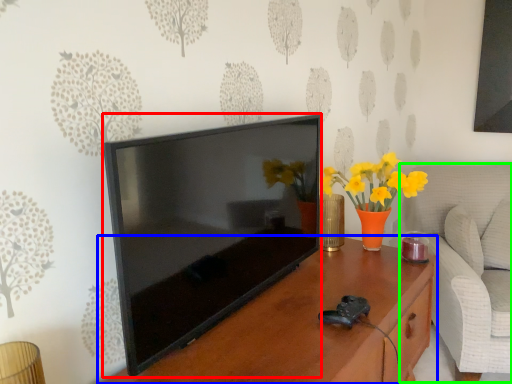
Question: Estimate the real-world distances between objects in this image. Which object is farther from television (highlighted by a red box), table (highlighted by a blue box) or swivel chair (highlighted by a green box)?

Choices:
 (A) table
 (B) swivel chair

Answer: (B)